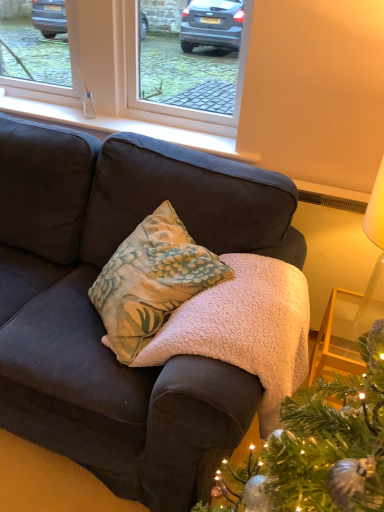
This screenshot has height=512, width=384. What do you see at coordinates (121, 70) in the screenshot? I see `white plastic window at upper center` at bounding box center [121, 70].

This screenshot has height=512, width=384. Describe the element at coordinates (119, 125) in the screenshot. I see `white smooth window sill at upper center` at that location.

This screenshot has height=512, width=384. I want to click on white paper lampshade at upper right, so click(352, 305).

Considering the sizes of objects white fleece blanket at center and white paper lampshade at upper right in the image provided, who is bigger, white fleece blanket at center or white paper lampshade at upper right?

With larger size is white fleece blanket at center.

From a real-world perspective, is white fleece blanket at center located higher than white paper lampshade at upper right?

No, from a real-world perspective, white fleece blanket at center is not over white paper lampshade at upper right

Between white fleece blanket at center and white paper lampshade at upper right, which one has less height?

Standing shorter between the two is white fleece blanket at center.

Based on their positions, is white plastic window at upper center located to the left or right of white smooth window sill at upper center?

From the image, it's evident that white plastic window at upper center is to the left of white smooth window sill at upper center.

Is white plastic window at upper center positioned behind white smooth window sill at upper center?

No, it is not.

Can you confirm if white plastic window at upper center is taller than white smooth window sill at upper center?

Yes, white plastic window at upper center is taller than white smooth window sill at upper center.

Between white fleece blanket at center and white plastic window at upper center, which one has smaller size?

→ white plastic window at upper center is smaller.

Between point (275, 359) and point (98, 80), which one is positioned behind?

The point (98, 80) is behind.

Between white fleece blanket at center and white plastic window at upper center, which one has smaller width?

white plastic window at upper center is thinner.

Is the depth of white fleece blanket at center less than that of white plastic window at upper center?

Yes, white fleece blanket at center is closer to the viewer.

The image size is (384, 512). Find the location of `table lamp above the white fleece blanket at center (from a real-world perspective)`. table lamp above the white fleece blanket at center (from a real-world perspective) is located at coordinates (352, 305).

Which is behind, white paper lampshade at upper right or white fleece blanket at center?

Positioned behind is white fleece blanket at center.

Which is more to the right, white paper lampshade at upper right or white fleece blanket at center?

From the viewer's perspective, white paper lampshade at upper right appears more on the right side.

Is white paper lampshade at upper right not close to white fleece blanket at center?

No, white paper lampshade at upper right is in close proximity to white fleece blanket at center.

Does point (114, 108) lie in front of point (349, 292)?

No.

How different are the orientations of white plastic window at upper center and white paper lampshade at upper right in degrees?

white plastic window at upper center and white paper lampshade at upper right are facing 89.8 degrees away from each other.

From the image's perspective, is white plastic window at upper center located above white paper lampshade at upper right?

Yes.

Which object is thinner, white plastic window at upper center or white paper lampshade at upper right?

white plastic window at upper center is thinner.

Does point (111, 27) come farther from viewer compared to point (230, 262)?

Yes.

Measure the distance between white plastic window at upper center and white fleece blanket at center.

white plastic window at upper center and white fleece blanket at center are 3.32 feet apart.

Is white plastic window at upper center inside the boundaries of white fleece blanket at center, or outside?

Answer: white plastic window at upper center exists outside the volume of white fleece blanket at center.

How distant is floral-patterned fabric pillow at center from white fleece blanket at center?

→ floral-patterned fabric pillow at center and white fleece blanket at center are 15.72 centimeters apart from each other.

Is floral-patterned fabric pillow at center at the left side of white fleece blanket at center?

Indeed, floral-patterned fabric pillow at center is positioned on the left side of white fleece blanket at center.

Is the position of floral-patterned fabric pillow at center more distant than that of white fleece blanket at center?

Yes, floral-patterned fabric pillow at center is further from the viewer.

Between floral-patterned fabric pillow at center and white fleece blanket at center, which one has smaller width?

Thinner between the two is floral-patterned fabric pillow at center.

At what (x,y) coordinates should I click in order to perform the action: click on blanket that is behind the white paper lampshade at upper right. Please return your answer as a coordinate pair (x, y). Looking at the image, I should click on (245, 329).

At what (x,y) coordinates should I click in order to perform the action: click on window that is above the white smooth window sill at upper center (from a real-world perspective). Please return your answer as a coordinate pair (x, y). This screenshot has width=384, height=512. Looking at the image, I should click on (121, 70).

Based on their spatial positions, is white fleece blanket at center or white plastic window at upper center further from floral-patterned fabric pillow at center?

The object further to floral-patterned fabric pillow at center is white plastic window at upper center.

Based on their spatial positions, is white plastic window at upper center or white fleece blanket at center further from white smooth window sill at upper center?

white fleece blanket at center is positioned further to the anchor white smooth window sill at upper center.

When comparing their distances from white paper lampshade at upper right, does white fleece blanket at center or white smooth window sill at upper center seem further?

Among the two, white smooth window sill at upper center is located further to white paper lampshade at upper right.

Looking at the image, which one is located further to white smooth window sill at upper center, white paper lampshade at upper right or floral-patterned fabric pillow at center?

white paper lampshade at upper right is positioned further to the anchor white smooth window sill at upper center.

Looking at the image, which one is located closer to white fleece blanket at center, floral-patterned fabric pillow at center or white paper lampshade at upper right?

Among the two, floral-patterned fabric pillow at center is located nearer to white fleece blanket at center.

Which object lies nearer to the anchor point floral-patterned fabric pillow at center, white fleece blanket at center or white smooth window sill at upper center?

Based on the image, white fleece blanket at center appears to be nearer to floral-patterned fabric pillow at center.

Which object lies further to the anchor point white plastic window at upper center, white smooth window sill at upper center or white fleece blanket at center?

Based on the image, white fleece blanket at center appears to be further to white plastic window at upper center.

In the scene shown: From the image, which object appears to be farther from white plastic window at upper center, white fleece blanket at center or white paper lampshade at upper right?

Among the two, white paper lampshade at upper right is located further to white plastic window at upper center.

Find the location of a particular element. blanket between white smooth window sill at upper center and white paper lampshade at upper right from left to right is located at coordinates (245, 329).

Locate an element on the screen. This screenshot has width=384, height=512. window sill that lies between white plastic window at upper center and floral-patterned fabric pillow at center from top to bottom is located at coordinates (119, 125).

Where is `window sill between white plastic window at upper center and white fleece blanket at center in the vertical direction`? window sill between white plastic window at upper center and white fleece blanket at center in the vertical direction is located at coordinates (119, 125).

Where is `blanket between floral-patterned fabric pillow at center and white paper lampshade at upper right`? This screenshot has width=384, height=512. blanket between floral-patterned fabric pillow at center and white paper lampshade at upper right is located at coordinates (245, 329).